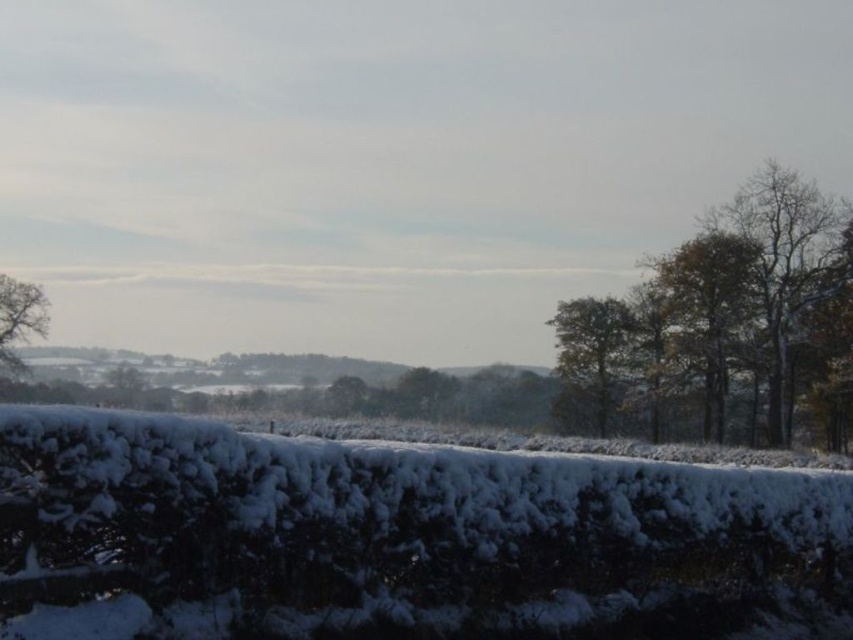
Is brown textured tree at right to the left of green leafy tree at center from the viewer's perspective?

Incorrect, brown textured tree at right is not on the left side of green leafy tree at center.

Can you confirm if brown textured tree at right is bigger than green leafy tree at center?

Yes, brown textured tree at right is bigger than green leafy tree at center.

Where is `brown textured tree at right`? This screenshot has height=640, width=853. brown textured tree at right is located at coordinates (723, 326).

Is the position of white fluffy hedge at lower center less distant than that of smooth brown tree at left?

Yes, white fluffy hedge at lower center is in front of smooth brown tree at left.

Can you confirm if white fluffy hedge at lower center is thinner than smooth brown tree at left?

Yes.

Does point (177, 588) lie in front of point (33, 308)?

Yes, it is in front of point (33, 308).

Find the location of `white fluffy hedge at lower center`. white fluffy hedge at lower center is located at coordinates (399, 538).

In the scene shown: Can you confirm if white fluffy hedge at lower center is positioned to the left of brown textured tree at right?

Indeed, white fluffy hedge at lower center is positioned on the left side of brown textured tree at right.

Between white fluffy hedge at lower center and brown textured tree at right, which one is positioned higher?

Positioned higher is brown textured tree at right.

Measure the distance between white fluffy hedge at lower center and camera.

30.43 feet

This screenshot has height=640, width=853. I want to click on white fluffy hedge at lower center, so click(x=399, y=538).